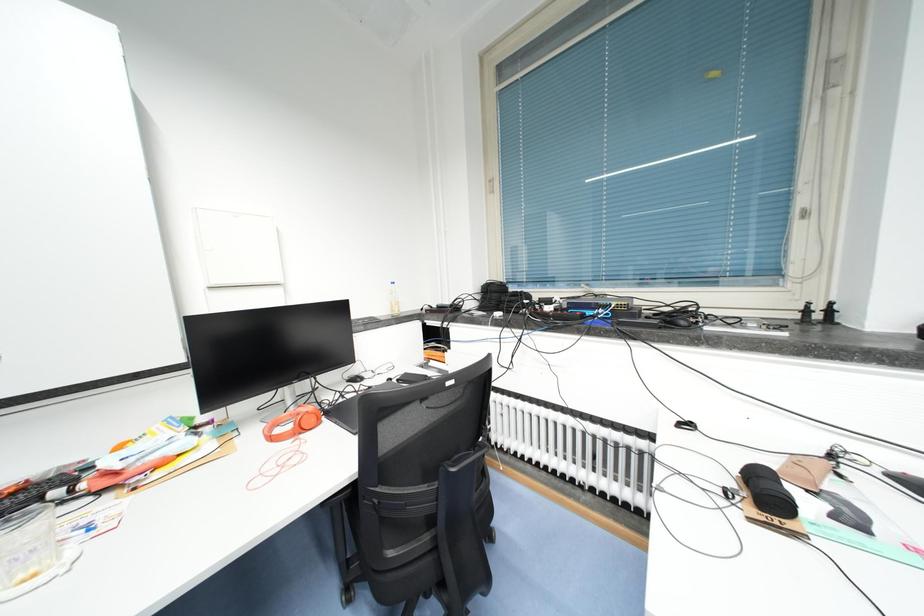
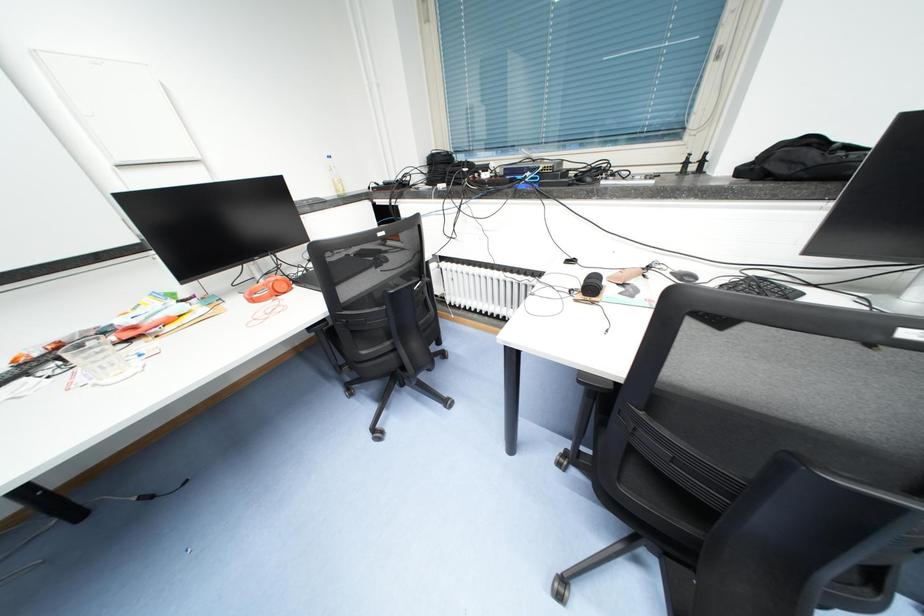
In a continuous first-person perspective shot, in which direction is the camera moving?

The movement direction of the cameraman is right, backward.